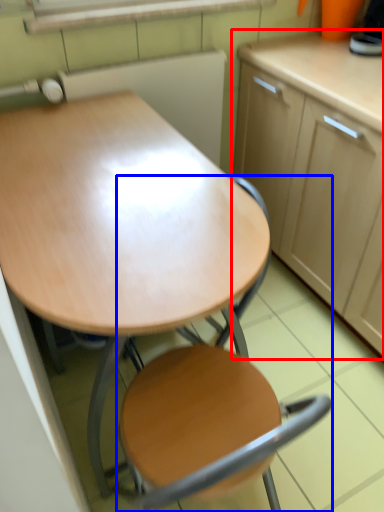
Question: Which object appears closest to the camera in this image, cabinetry (highlighted by a red box) or chair (highlighted by a blue box)?

Choices:
 (A) cabinetry
 (B) chair

Answer: (B)